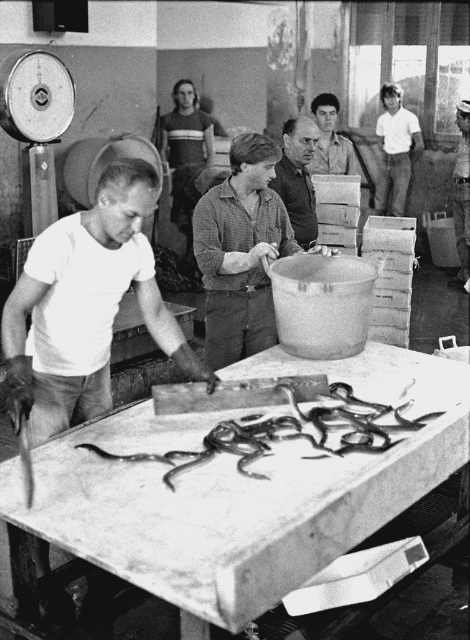
Can you confirm if white matte shirt at left is shorter than shiny black snake at center?

Incorrect, white matte shirt at left's height does not fall short of shiny black snake at center's.

The height and width of the screenshot is (640, 470). Describe the element at coordinates (86, 307) in the screenshot. I see `white matte shirt at left` at that location.

You are a GUI agent. You are given a task and a screenshot of the screen. Output one action in this format:
    pyautogui.click(x=<x>, y=<y>)
    Task: Click on the white matte shirt at left
    This screenshot has height=640, width=470.
    Given the screenshot: What is the action you would take?
    pyautogui.click(x=86, y=307)

Does white matte shirt at upper right have a greater height compared to smooth gray shirt at center?

Yes, white matte shirt at upper right is taller than smooth gray shirt at center.

Is white matte shirt at upper right thinner than smooth gray shirt at center?

No.

This screenshot has width=470, height=640. Find the location of `white matte shirt at upper right`. white matte shirt at upper right is located at coordinates (394, 150).

Which is more to the right, smooth white table at center or matte brown shirt at center?

smooth white table at center is more to the right.

Does smooth white table at center have a greater width compared to matte brown shirt at center?

Indeed, smooth white table at center has a greater width compared to matte brown shirt at center.

Is point (57, 493) behind point (260, 138)?

That is False.

Locate an element on the screen. smooth white table at center is located at coordinates (241, 490).